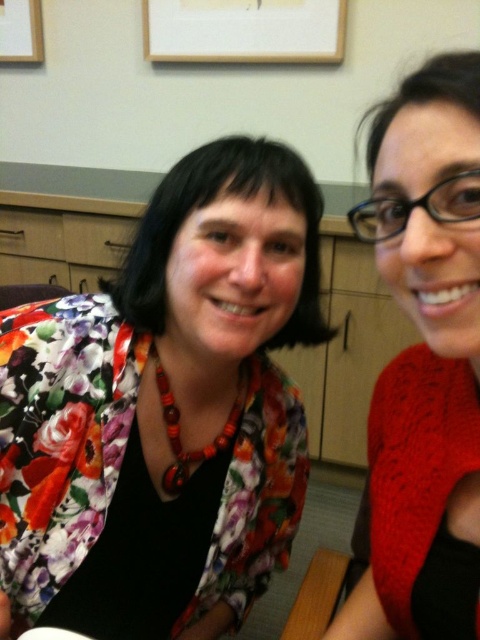
Does floral fabric jacket at center appear on the left side of knitted red sweater at right?

Correct, you'll find floral fabric jacket at center to the left of knitted red sweater at right.

Which is in front, point (187, 595) or point (431, 557)?

Positioned in front is point (431, 557).

Is point (184, 465) behind point (447, 508)?

Yes.

I want to click on floral fabric jacket at center, so click(x=167, y=408).

Does knitted red sweater at right have a lesser width compared to wooden picture frame at upper left?

Correct, knitted red sweater at right's width is less than wooden picture frame at upper left's.

Is the position of knitted red sweater at right more distant than that of wooden picture frame at upper left?

No, knitted red sweater at right is in front of wooden picture frame at upper left.

Does point (456, 108) lie in front of point (9, 56)?

Yes, point (456, 108) is in front of point (9, 56).

What are the coordinates of `knitted red sweater at right` in the screenshot? It's located at (424, 362).

Is floral fabric jacket at center below wooden picture frame at upper left?

Yes.

Between point (214, 164) and point (36, 13), which one is positioned in front?

Point (214, 164)

Locate an element on the screen. The height and width of the screenshot is (640, 480). floral fabric jacket at center is located at coordinates (167, 408).